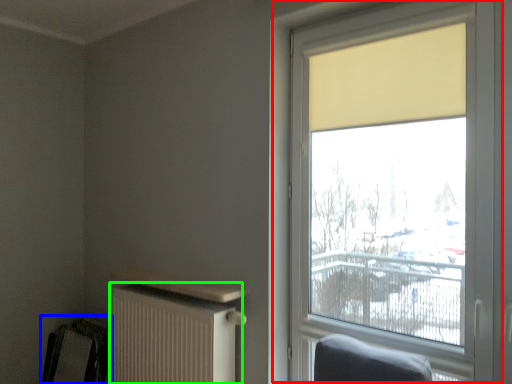
Question: Considering the real-world distances, which object is farthest from window (highlighted by a red box)? swivel chair (highlighted by a blue box) or radiator (highlighted by a green box)?

Choices:
 (A) swivel chair
 (B) radiator

Answer: (A)